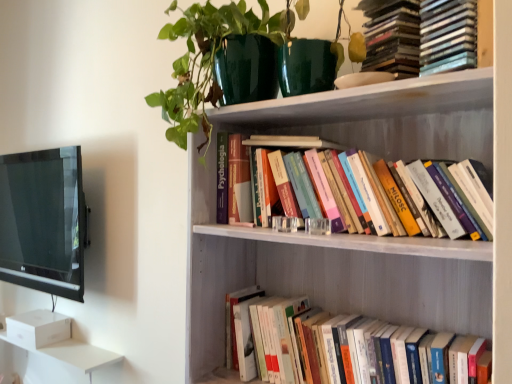
Question: Is hardcover books at lower right, which ranks as the 1th book in bottom-to-top order, taller than green glossy pot at upper center?

Choices:
 (A) no
 (B) yes

Answer: (A)

Question: From a real-world perspective, is hardcover books at lower right, which ranks as the 1th book in bottom-to-top order, beneath green glossy pot at upper center?

Choices:
 (A) no
 (B) yes

Answer: (B)

Question: Can you confirm if hardcover books at lower right, which ranks as the 1th book in bottom-to-top order, is smaller than green glossy pot at upper center?

Choices:
 (A) no
 (B) yes

Answer: (B)

Question: From the image's perspective, does hardcover books at lower right, which ranks as the 1th book in bottom-to-top order, appear lower than green glossy pot at upper center?

Choices:
 (A) no
 (B) yes

Answer: (B)

Question: Can you confirm if hardcover books at lower right, which ranks as the 1th book in bottom-to-top order, is shorter than green glossy pot at upper center?

Choices:
 (A) no
 (B) yes

Answer: (B)

Question: Is green glossy pot at upper center in front of or behind white wooden bookshelf at upper center in the image?

Choices:
 (A) behind
 (B) front

Answer: (A)

Question: From a real-world perspective, relative to white wooden bookshelf at upper center, is green glossy pot at upper center vertically above or below?

Choices:
 (A) below
 (B) above

Answer: (B)

Question: Based on their positions, is green glossy pot at upper center located to the left or right of white wooden bookshelf at upper center?

Choices:
 (A) left
 (B) right

Answer: (A)

Question: Looking at their shapes, would you say green glossy pot at upper center is wider or thinner than white wooden bookshelf at upper center?

Choices:
 (A) wide
 (B) thin

Answer: (B)

Question: From a real-world perspective, is white wooden bookshelf at upper center positioned above or below green glossy pot at upper center?

Choices:
 (A) below
 (B) above

Answer: (A)

Question: Visually, is white wooden bookshelf at upper center positioned to the left or to the right of green glossy pot at upper center?

Choices:
 (A) right
 (B) left

Answer: (A)

Question: From the image's perspective, is white wooden bookshelf at upper center located above or below green glossy pot at upper center?

Choices:
 (A) below
 (B) above

Answer: (A)

Question: Is white wooden bookshelf at upper center spatially inside green glossy pot at upper center, or outside of it?

Choices:
 (A) inside
 (B) outside

Answer: (B)

Question: Considering their positions, is black glossy tv at left located in front of or behind hardcover books at upper center, marked as the second book in a top-to-bottom arrangement?

Choices:
 (A) front
 (B) behind

Answer: (B)

Question: Is black glossy tv at left taller or shorter than hardcover books at upper center, marked as the second book in a top-to-bottom arrangement?

Choices:
 (A) short
 (B) tall

Answer: (B)